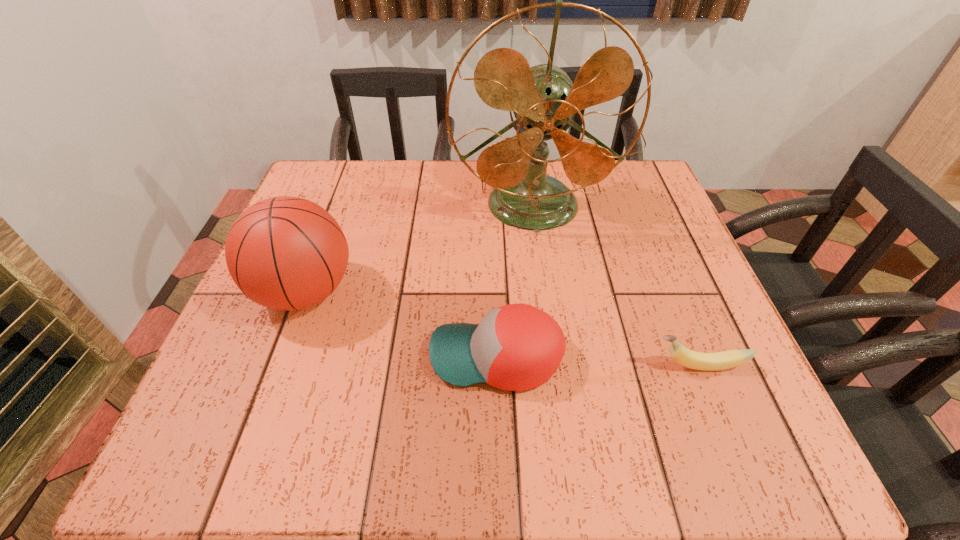
The image size is (960, 540). Identify the location of vacant area at the near edge. (294, 443).

Image resolution: width=960 pixels, height=540 pixels. What are the coordinates of `free region at the left edge` in the screenshot? It's located at (198, 411).

Where is `vacant space at the right edge`? vacant space at the right edge is located at coordinates (615, 214).

Find the location of a particular element. This screenshot has width=960, height=540. free location at the far left corner of the desktop is located at coordinates (341, 164).

The image size is (960, 540). What are the coordinates of `free region at the near left corner of the desktop` in the screenshot? It's located at (183, 452).

Where is `vacant space at the far right corner`? This screenshot has height=540, width=960. vacant space at the far right corner is located at coordinates [x=612, y=191].

Identify the location of free region at the near right corner of the desktop. This screenshot has height=540, width=960. click(x=780, y=462).

Locate an element on the screen. The image size is (960, 540). free space between the baseball cap and the banana is located at coordinates (597, 361).

Locate an element on the screen. This screenshot has height=540, width=960. unoccupied area between the baseball cap and the second tallest object is located at coordinates tap(400, 325).

At what (x,y) coordinates should I click in order to perform the action: click on unoccupied area between the fan and the banana. Please return your answer as a coordinate pair (x, y). This screenshot has height=540, width=960. Looking at the image, I should click on [x=615, y=286].